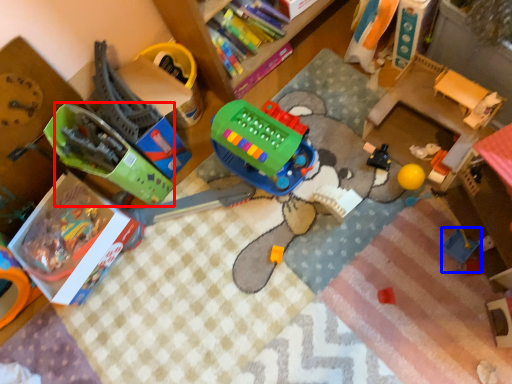
Question: Which object appears closest to the camera in this image, toy (highlighted by a red box) or toy (highlighted by a blue box)?

Choices:
 (A) toy
 (B) toy

Answer: (A)